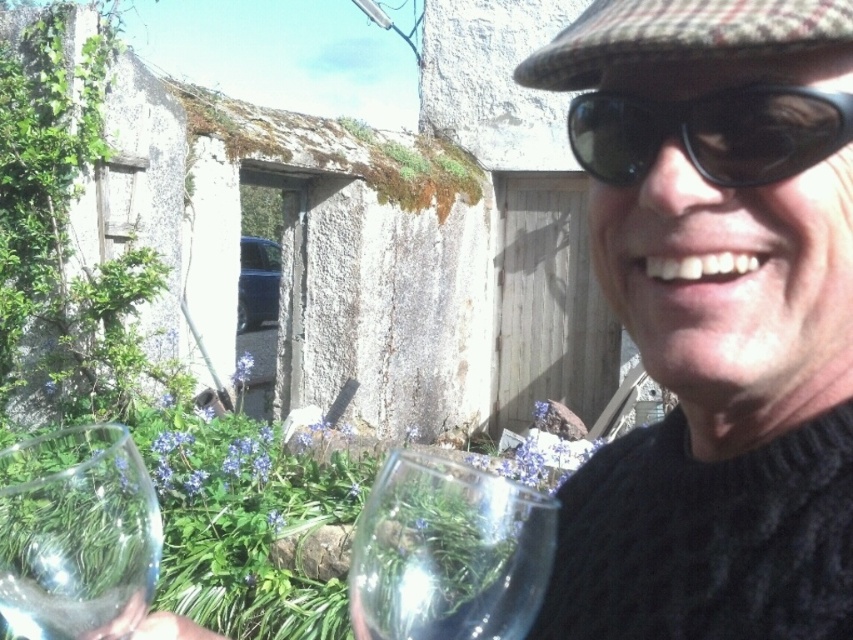
Does transparent glass at lower center have a greater width compared to black plastic goggles at upper right?

Yes.

Does transparent glass at lower center have a lesser height compared to black plastic goggles at upper right?

Incorrect, transparent glass at lower center's height does not fall short of black plastic goggles at upper right's.

This screenshot has height=640, width=853. Find the location of `transparent glass at lower center`. transparent glass at lower center is located at coordinates (448, 552).

This screenshot has height=640, width=853. What are the coordinates of `transparent glass at lower center` in the screenshot? It's located at [448, 552].

What do you see at coordinates (448, 552) in the screenshot?
I see `transparent glass at lower center` at bounding box center [448, 552].

Measure the distance between transparent glass at lower center and transparent glass at lower left.

transparent glass at lower center and transparent glass at lower left are 31.60 centimeters apart from each other.

Is point (552, 547) closer to camera compared to point (97, 600)?

That is False.

This screenshot has height=640, width=853. I want to click on transparent glass at lower center, so click(x=448, y=552).

Does transparent glass at lower left appear over black plastic goggles at upper right?

No.

Who is shorter, transparent glass at lower left or black plastic goggles at upper right?

With less height is black plastic goggles at upper right.

Who is more distant from viewer, (91, 458) or (721, 145)?

Positioned behind is point (91, 458).

Locate an element on the screen. transparent glass at lower left is located at coordinates 74,531.